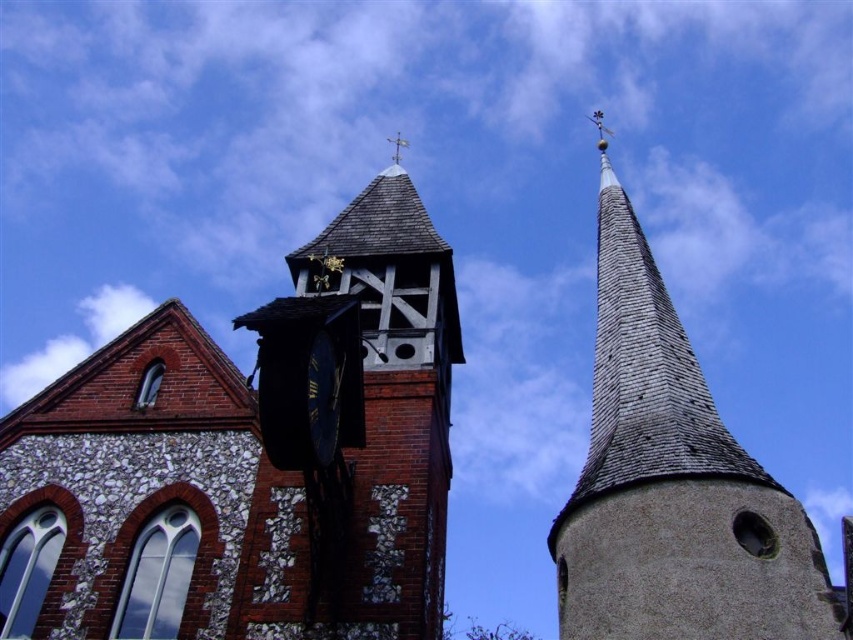
You are standing in front of the church and want to take a photo that includes both the brick clock tower at center and the blue metallic clock at center. Which one should you focus on to ensure both are in the frame without cropping?

You should focus on the brick clock tower at center because it is much taller than the blue metallic clock at center, so positioning the camera to include its full height will naturally include the smaller clock as well.

You are standing at the entrance of the church and want to locate the brick clock tower at center. According to the coordinates provided, in which direction should you look to find it?

The brick clock tower at center is located at coordinates point (248, 460), which means it is positioned towards the upper right direction from your current position at the entrance.